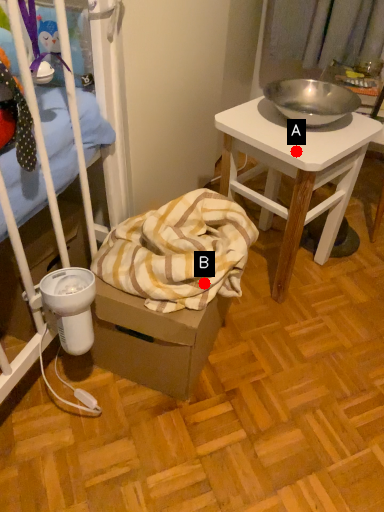
Question: Two points are circled on the image, labeled by A and B beside each circle. Which point appears farthest from the camera in this image?

Choices:
 (A) A is further
 (B) B is further

Answer: (A)